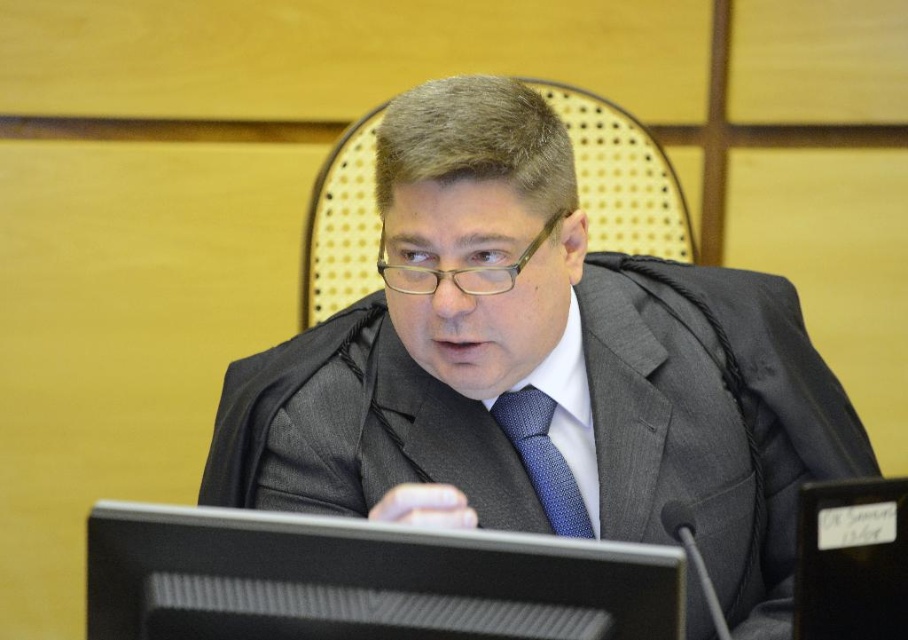
Question: Considering the real-world distances, which object is farthest from the blue dotted fabric tie at center?

Choices:
 (A) black matte computer screen at center
 (B) gray suit at center

Answer: (A)

Question: Which of the following is the farthest from the observer?

Choices:
 (A) (242, 554)
 (B) (534, 481)

Answer: (B)

Question: Which object appears closest to the camera in this image?

Choices:
 (A) blue dotted fabric tie at center
 (B) black matte computer screen at center
 (C) gray suit at center

Answer: (B)

Question: Where is gray suit at center located in relation to black matte computer screen at center in the image?

Choices:
 (A) right
 (B) left

Answer: (A)

Question: Does gray suit at center appear on the right side of blue dotted fabric tie at center?

Choices:
 (A) yes
 (B) no

Answer: (A)

Question: Is gray suit at center below black matte computer screen at center?

Choices:
 (A) yes
 (B) no

Answer: (B)